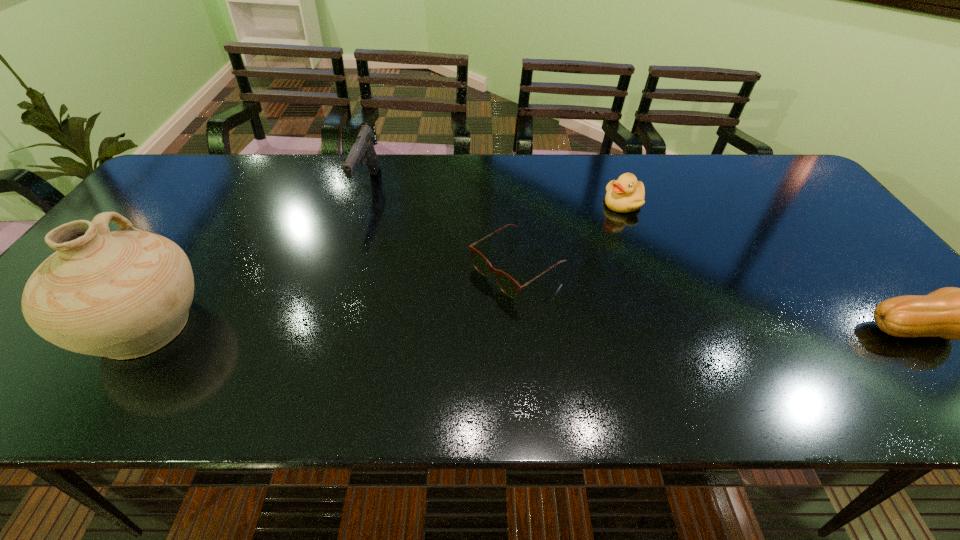
Identify the location of vacant space situated 0.150m on the front-facing side of the fourth object from left to right. (600, 245).

Where is `vacant space located 0.120m at the front view of the spectacles`? This screenshot has width=960, height=540. vacant space located 0.120m at the front view of the spectacles is located at coordinates (439, 318).

Find the location of a particular element. vacant space situated at the front view of the spectacles is located at coordinates (377, 358).

Identify the location of free space located 0.190m at the front view of the spectacles. (413, 335).

What are the coordinates of `vacant space located at the muzzle of the fourth object from right to left` in the screenshot? It's located at (420, 281).

Find the location of a particular element. The height and width of the screenshot is (540, 960). vacant space located at the muzzle of the fourth object from right to left is located at coordinates (378, 226).

Locate an element on the screen. vacant area situated 0.300m at the muzzle of the fourth object from right to left is located at coordinates (413, 272).

Where is `duckling located in the far edge section of the desktop`? duckling located in the far edge section of the desktop is located at coordinates (626, 194).

This screenshot has width=960, height=540. I want to click on gun at the far edge, so click(363, 148).

Identify the location of object at the near edge. 124,294.